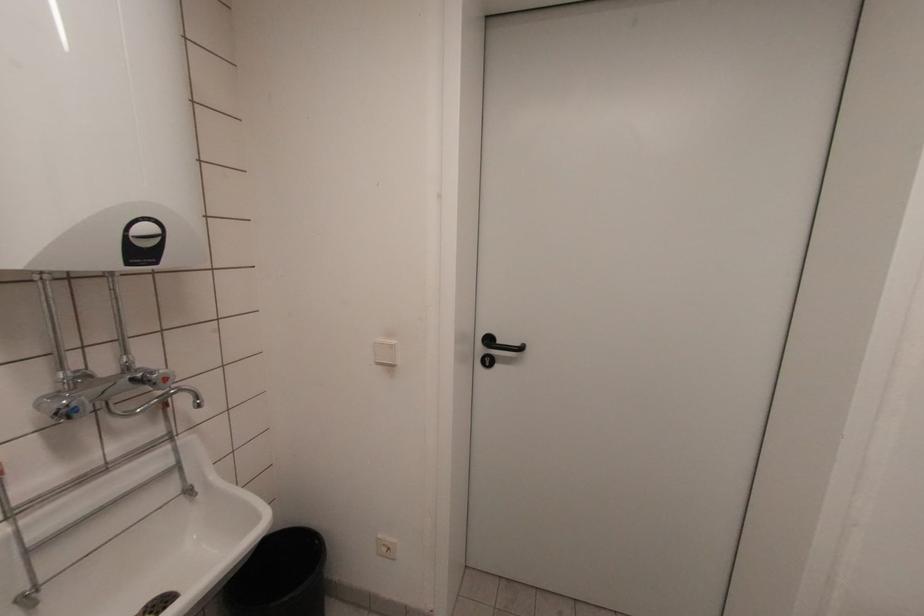
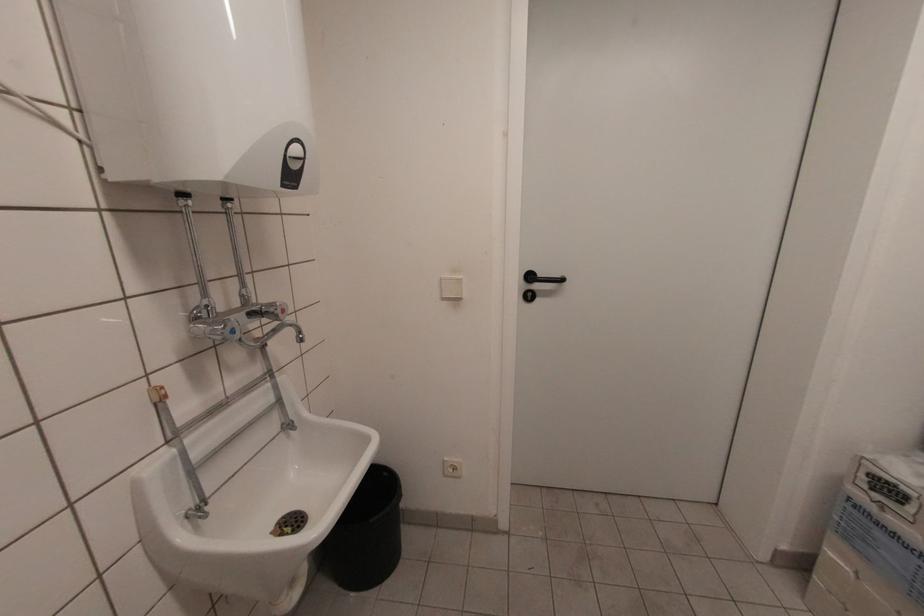
Question: The images are taken continuously from a first-person perspective. In which direction are you moving?

Choices:
 (A) Left
 (B) Right
 (C) Forward
 (D) Backward

Answer: (A)